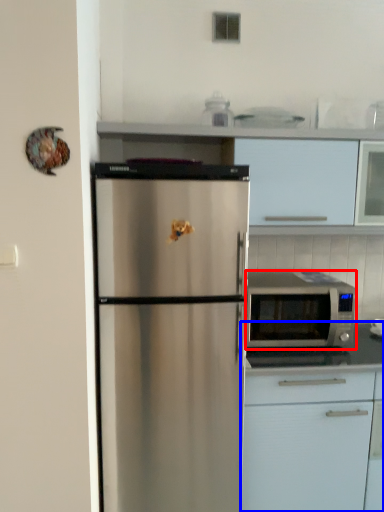
Question: Among these objects, which one is nearest to the camera, microwave oven (highlighted by a red box) or cabinetry (highlighted by a blue box)?

Choices:
 (A) microwave oven
 (B) cabinetry

Answer: (B)